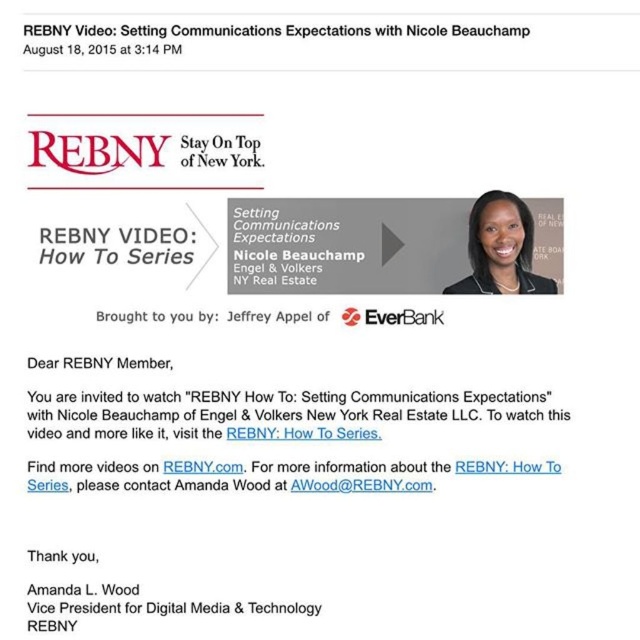
Question: Estimate the real-world distances between objects in this image. Which object is closer to the black glossy hair at upper right?

Choices:
 (A) white paper at upper center
 (B) gray matte text at center

Answer: (B)

Question: Estimate the real-world distances between objects in this image. Which object is farther from the gray matte text at center?

Choices:
 (A) whitetextured paperrebny: how to series at center
 (B) black glossy hair at upper right
 (C) white paper at center

Answer: (A)

Question: Does white paper at upper center have a smaller size compared to black paper at lower center?

Choices:
 (A) yes
 (B) no

Answer: (B)

Question: Does white paper at upper center have a lesser width compared to white text at upper center?

Choices:
 (A) no
 (B) yes

Answer: (A)

Question: Among these objects, which one is farthest from the camera?

Choices:
 (A) gray matte text at center
 (B) whitetextured paperrebny: how to series at center
 (C) white paper at center

Answer: (A)

Question: Can you confirm if gray matte text at center is wider than black paper at lower center?

Choices:
 (A) yes
 (B) no

Answer: (B)